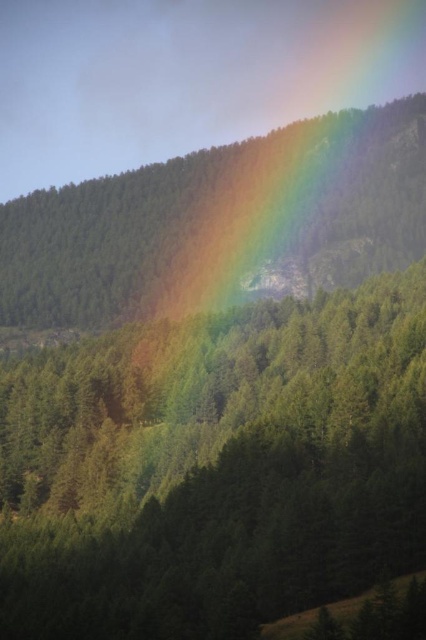
You are an environmental scientist studying the forest structure. You observe the green matte tree at center and the smooth green forest at upper center. Which of these two objects is positioned lower in the image?

The green matte tree at center is positioned below the smooth green forest at upper center, so it is lower in the image.

You are standing in the forest and see the point marked at coordinate (215,468). What object is located at that point?

The green matte tree at center is located at the point marked at coordinate (215,468).